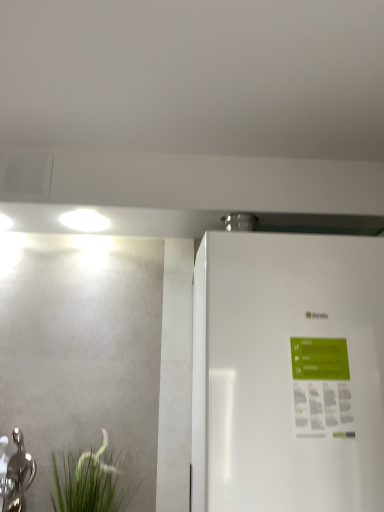
Question: Could green matte plant at lower left be considered to be inside white glossy refrigerator at right?

Choices:
 (A) yes
 (B) no

Answer: (B)

Question: Does white glossy refrigerator at right lie in front of green matte plant at lower left?

Choices:
 (A) no
 (B) yes

Answer: (B)

Question: Is white glossy refrigerator at right not close to green matte plant at lower left?

Choices:
 (A) yes
 (B) no

Answer: (B)

Question: Is white glossy refrigerator at right positioned with its back to green matte plant at lower left?

Choices:
 (A) yes
 (B) no

Answer: (B)

Question: Is white glossy refrigerator at right placed right next to green matte plant at lower left?

Choices:
 (A) yes
 (B) no

Answer: (B)

Question: Considering their positions, is silver metallic tap at lower left located in front of or behind white glossy refrigerator at right?

Choices:
 (A) front
 (B) behind

Answer: (B)

Question: Considering the positions of silver metallic tap at lower left and white glossy refrigerator at right in the image, is silver metallic tap at lower left wider or thinner than white glossy refrigerator at right?

Choices:
 (A) thin
 (B) wide

Answer: (A)

Question: In the image, is silver metallic tap at lower left on the left side or the right side of white glossy refrigerator at right?

Choices:
 (A) left
 (B) right

Answer: (A)

Question: From the image's perspective, is silver metallic tap at lower left above or below white glossy refrigerator at right?

Choices:
 (A) below
 (B) above

Answer: (A)

Question: In terms of width, does silver metallic tap at lower left look wider or thinner when compared to green matte plant at lower left?

Choices:
 (A) wide
 (B) thin

Answer: (B)

Question: In terms of height, does silver metallic tap at lower left look taller or shorter compared to green matte plant at lower left?

Choices:
 (A) tall
 (B) short

Answer: (A)

Question: Looking at the image, does silver metallic tap at lower left seem bigger or smaller compared to green matte plant at lower left?

Choices:
 (A) big
 (B) small

Answer: (B)

Question: From the image's perspective, relative to green matte plant at lower left, is silver metallic tap at lower left above or below?

Choices:
 (A) above
 (B) below

Answer: (A)

Question: Considering the positions of white glossy refrigerator at right and silver metallic tap at lower left in the image, is white glossy refrigerator at right taller or shorter than silver metallic tap at lower left?

Choices:
 (A) short
 (B) tall

Answer: (B)

Question: Is white glossy refrigerator at right in front of or behind silver metallic tap at lower left in the image?

Choices:
 (A) behind
 (B) front

Answer: (B)